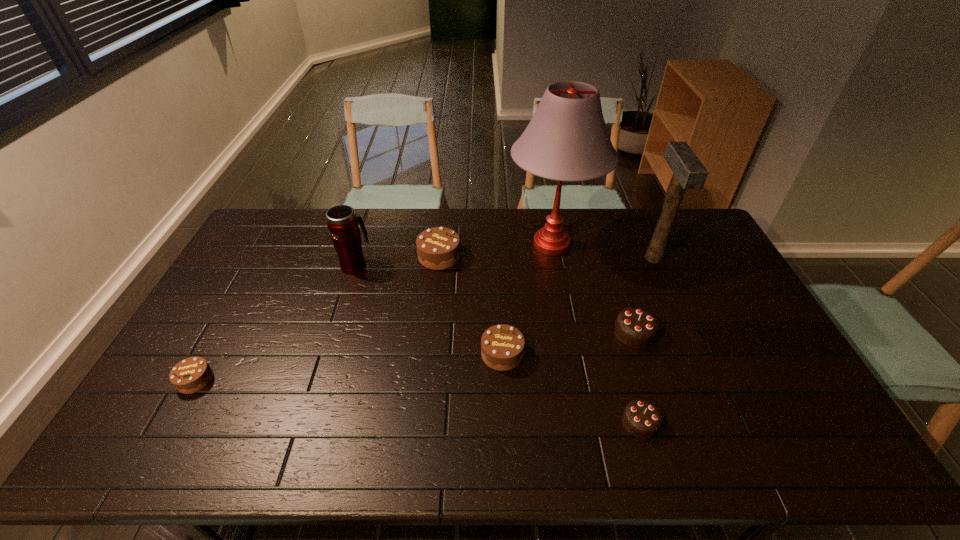
The image size is (960, 540). I want to click on unoccupied position between the farthest chocolate cake and the farther chocolate chocolate cake, so click(x=537, y=295).

Find the location of `free space between the smallest brown chocolate cake and the bigger chocolate chocolate cake`. free space between the smallest brown chocolate cake and the bigger chocolate chocolate cake is located at coordinates (415, 356).

Where is `free spot between the rightmost object and the second brown chocolate cake from right to left`? free spot between the rightmost object and the second brown chocolate cake from right to left is located at coordinates (546, 257).

At what (x,y) coordinates should I click in order to perform the action: click on free space between the second brown chocolate cake from right to left and the tallest object. Please return your answer as a coordinate pair (x, y). Looking at the image, I should click on (495, 251).

You are a GUI agent. You are given a task and a screenshot of the screen. Output one action in this format:
    pyautogui.click(x=<x>, y=<y>)
    Task: Click on the vacant area that lies between the leftmost chocolate cake and the light table lamp
    The width and height of the screenshot is (960, 540).
    Given the screenshot: What is the action you would take?
    pyautogui.click(x=373, y=312)

Identify which object is the nearest to the fourth tallest object. Please provide its 2D coordinates. Your answer should be formatted as a tuple, i.e. [(x, y)], where the tuple contains the x and y coordinates of a point satisfying the conditions above.

[(342, 223)]

Where is `the sixth closest object relative to the second smallest brown chocolate cake`? This screenshot has width=960, height=540. the sixth closest object relative to the second smallest brown chocolate cake is located at coordinates (688, 172).

Identify which chocolate cake is the fifth nearest to the third tallest object. Please provide its 2D coordinates. Your answer should be formatted as a tuple, i.e. [(x, y)], where the tuple contains the x and y coordinates of a point satisfying the conditions above.

[(641, 418)]

The width and height of the screenshot is (960, 540). Find the location of `chocolate cake that stands as the fourth closest to the nearer chocolate chocolate cake`. chocolate cake that stands as the fourth closest to the nearer chocolate chocolate cake is located at coordinates coord(192,374).

Find the location of a particular element. This screenshot has width=960, height=540. the closest brown chocolate cake to the seventh object from right to left is located at coordinates coord(438,248).